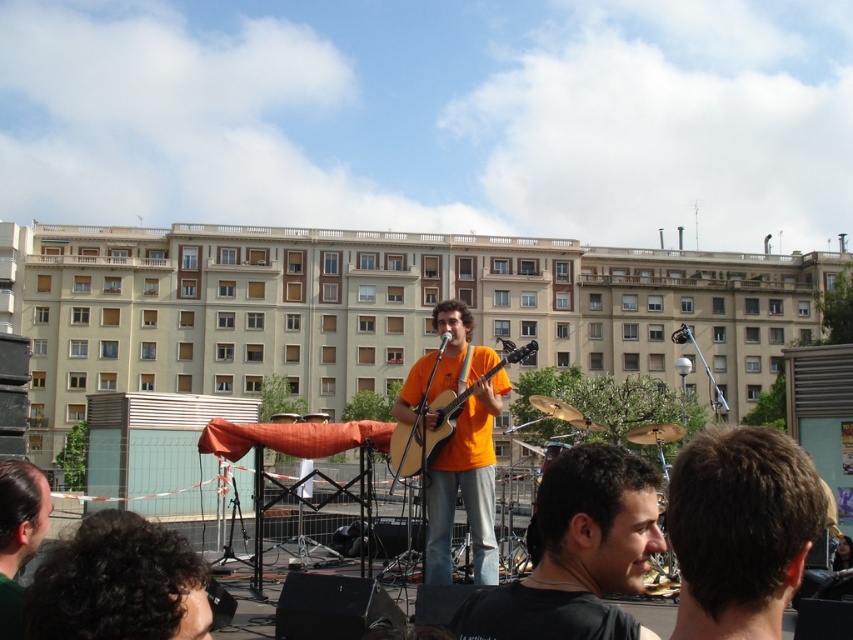
Does dark brown hair at center appear under acoustic wood guitar at center?

Indeed, dark brown hair at center is positioned under acoustic wood guitar at center.

The image size is (853, 640). What do you see at coordinates (740, 531) in the screenshot?
I see `dark brown hair at center` at bounding box center [740, 531].

Measure the distance between dark brown hair at center and camera.

A distance of 26.23 meters exists between dark brown hair at center and camera.

What are the coordinates of `dark brown hair at center` in the screenshot? It's located at (740, 531).

Between curly hair at lower left and acoustic wood guitar at center, which one appears on the right side from the viewer's perspective?

acoustic wood guitar at center

Does curly hair at lower left have a greater width compared to acoustic wood guitar at center?

No, curly hair at lower left is not wider than acoustic wood guitar at center.

Is point (143, 609) farther from viewer compared to point (450, 420)?

That is False.

Where is `curly hair at lower left`? This screenshot has height=640, width=853. curly hair at lower left is located at coordinates (119, 582).

Which is below, black matte shirt at lower right or dark brown hair at lower left?

black matte shirt at lower right is lower down.

Between point (614, 528) and point (30, 484), which one is positioned behind?

Positioned behind is point (30, 484).

Identify the location of black matte shirt at lower right. This screenshot has height=640, width=853. (577, 554).